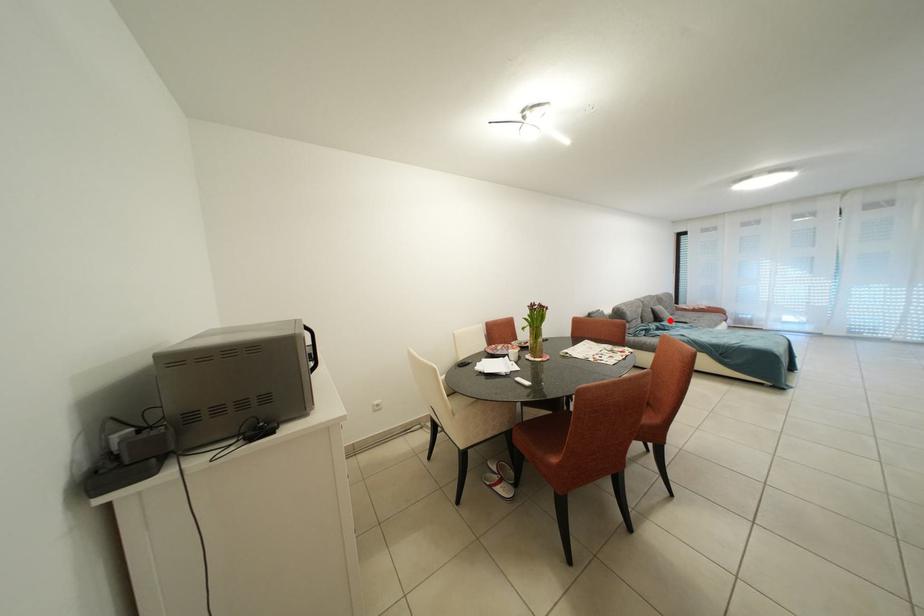
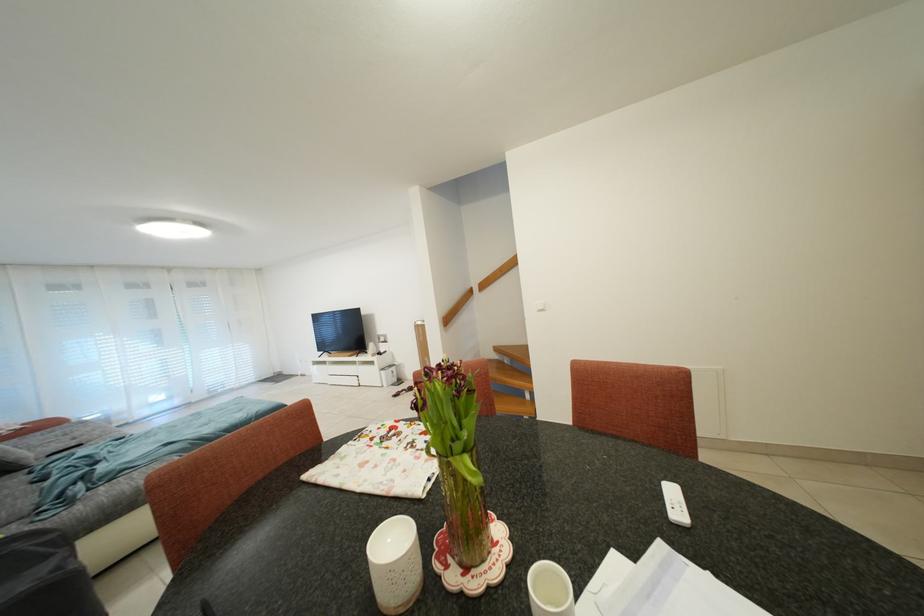
Question: I am providing you with two images of the same scene from different viewpoints. Given a red point in image1, look at the same physical point in image2. Is it:

Choices:
 (A) Closer to the viewpoint
 (B) Farther from the viewpoint

Answer: (B)